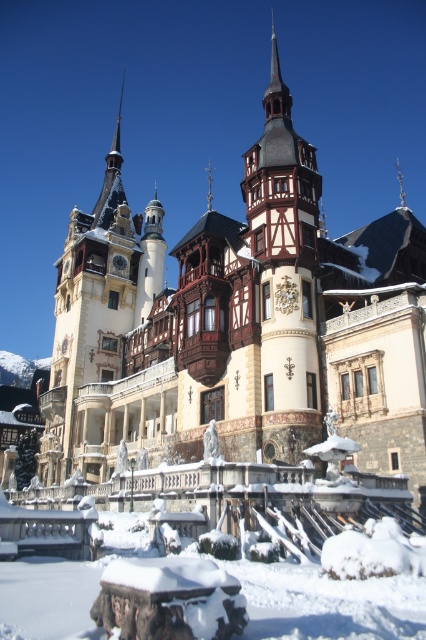
Question: Which object is farther from the camera taking this photo?

Choices:
 (A) white painted wood tower at left
 (B) wooden tower at center

Answer: (A)

Question: Among these objects, which one is nearest to the camera?

Choices:
 (A) white painted wood tower at left
 (B) wooden tower at center

Answer: (B)

Question: Is white painted wood tower at left to the right of wooden tower at center from the viewer's perspective?

Choices:
 (A) no
 (B) yes

Answer: (A)

Question: Which point is closer to the camera taking this photo?

Choices:
 (A) (43, 410)
 (B) (291, 243)

Answer: (B)

Question: Can you confirm if white painted wood tower at left is positioned to the left of wooden tower at center?

Choices:
 (A) yes
 (B) no

Answer: (A)

Question: Is white painted wood tower at left to the left of wooden tower at center from the viewer's perspective?

Choices:
 (A) yes
 (B) no

Answer: (A)